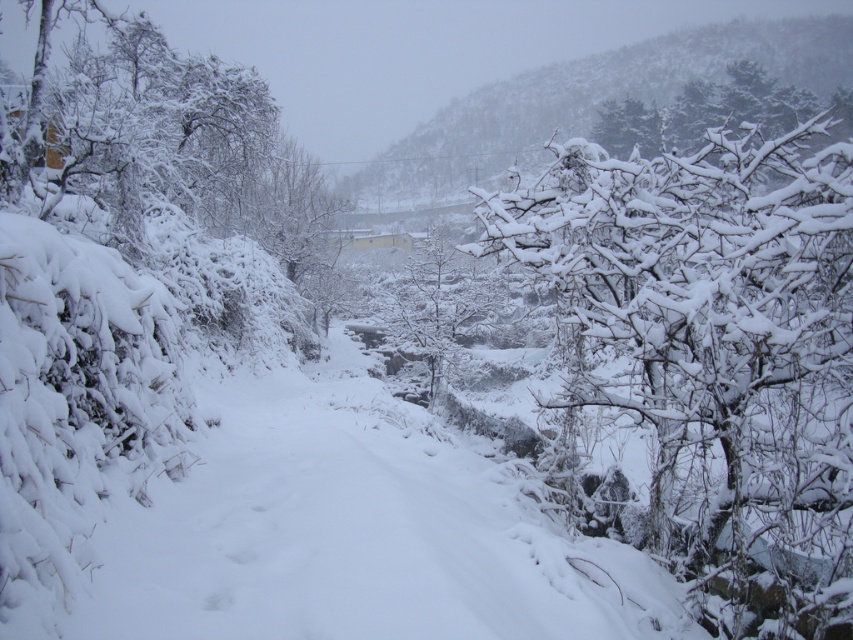
Is white snow-covered branches at upper right smaller than white snow-covered tree at center?

Actually, white snow-covered branches at upper right might be larger than white snow-covered tree at center.

Does point (660, 148) come farther from viewer compared to point (444, 374)?

Yes, it is.

Measure the distance between white snow-covered branches at upper right and camera.

A distance of 43.29 meters exists between white snow-covered branches at upper right and camera.

The image size is (853, 640). I want to click on white snow-covered branches at upper right, so click(x=703, y=113).

Is point (596, 148) positioned before point (390, 330)?

Yes, point (596, 148) is closer to viewer.

Find the location of a particular element. white snow-covered tree at upper right is located at coordinates (714, 353).

Does white snow-covered tree at upper right appear under white snow-covered branches at upper right?

Yes, white snow-covered tree at upper right is below white snow-covered branches at upper right.

Does white snow-covered tree at upper right come behind white snow-covered branches at upper right?

No, white snow-covered tree at upper right is in front of white snow-covered branches at upper right.

Does point (647, 220) come farther from viewer compared to point (793, 97)?

That is False.

You are a GUI agent. You are given a task and a screenshot of the screen. Output one action in this format:
    pyautogui.click(x=<x>, y=<y>)
    Task: Click on the white snow-covered tree at upper right
    
    Given the screenshot: What is the action you would take?
    pyautogui.click(x=714, y=353)